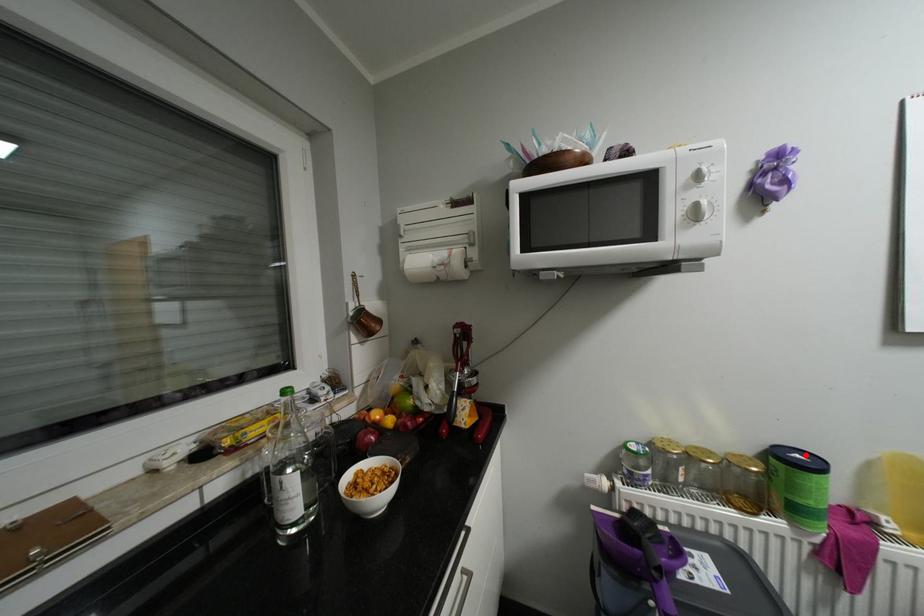
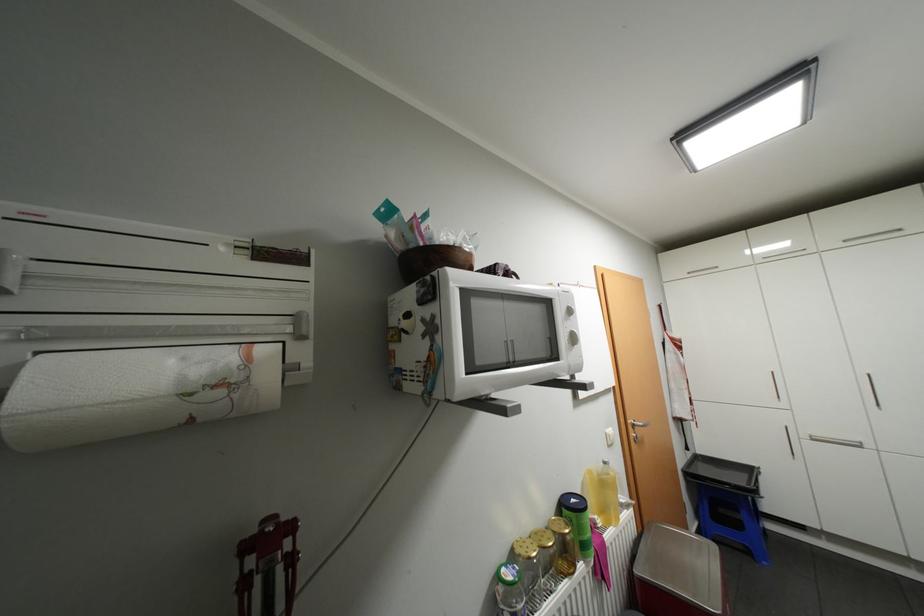
In the second image, find the point that corresponds to the highlighted location in the first image.

(580, 499)